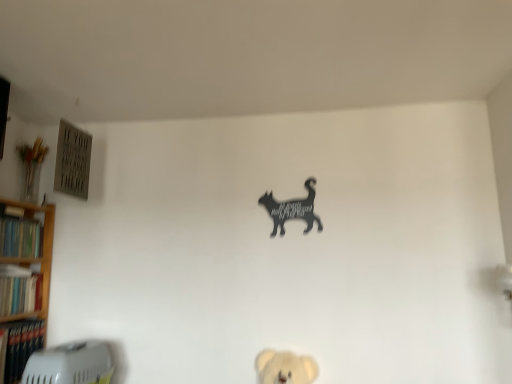
Question: Is hardcover book at left, the third book from the bottom, looking in the opposite direction of hardcover book at left, which is the 1th book from bottom to top?

Choices:
 (A) no
 (B) yes

Answer: (A)

Question: From the image's perspective, is hardcover book at left, the third book from the bottom, beneath hardcover book at left, which is counted as the third book, starting from the top?

Choices:
 (A) no
 (B) yes

Answer: (A)

Question: Is hardcover book at left, the third book from the bottom, shorter than hardcover book at left, which is counted as the third book, starting from the top?

Choices:
 (A) yes
 (B) no

Answer: (A)

Question: Does hardcover book at left, the first book from the top, appear on the left side of hardcover book at left, which is counted as the third book, starting from the top?

Choices:
 (A) yes
 (B) no

Answer: (A)

Question: Considering the relative positions of hardcover book at left, the first book from the top, and hardcover book at left, which is counted as the third book, starting from the top, in the image provided, is hardcover book at left, the first book from the top, behind hardcover book at left, which is counted as the third book, starting from the top,?

Choices:
 (A) no
 (B) yes

Answer: (B)

Question: Is hardcover book at left, the first book from the top, bigger than hardcover book at left, which is the 1th book from bottom to top?

Choices:
 (A) yes
 (B) no

Answer: (B)

Question: Can you confirm if hardcover book at left, which is counted as the third book, starting from the top, is bigger than black matte cat at upper center?

Choices:
 (A) yes
 (B) no

Answer: (A)

Question: Is hardcover book at left, which is counted as the third book, starting from the top, positioned with its back to black matte cat at upper center?

Choices:
 (A) no
 (B) yes

Answer: (A)

Question: Is hardcover book at left, which is the 1th book from bottom to top, thinner than black matte cat at upper center?

Choices:
 (A) no
 (B) yes

Answer: (A)

Question: Does hardcover book at left, which is the 1th book from bottom to top, have a greater width compared to black matte cat at upper center?

Choices:
 (A) no
 (B) yes

Answer: (B)

Question: Does hardcover book at left, which is counted as the third book, starting from the top, have a greater height compared to black matte cat at upper center?

Choices:
 (A) no
 (B) yes

Answer: (A)

Question: Can you see hardcover book at left, which is the 1th book from bottom to top, touching black matte cat at upper center?

Choices:
 (A) no
 (B) yes

Answer: (A)

Question: From the image's perspective, does black matte cat at upper center appear lower than hardcover book at left, which ranks as the second book in top-to-bottom order?

Choices:
 (A) no
 (B) yes

Answer: (A)